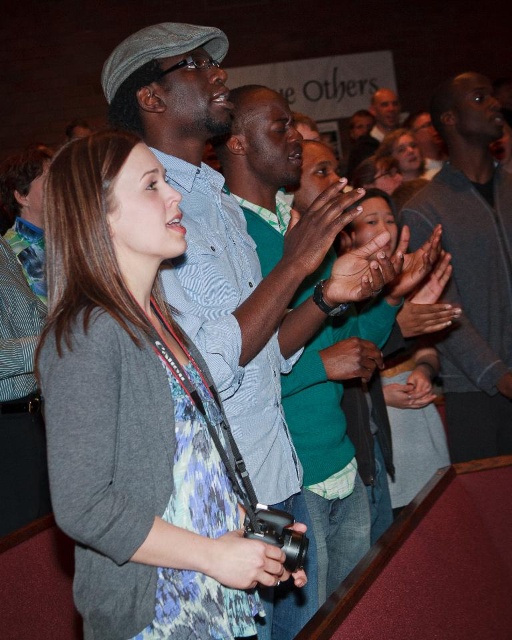
Question: Can you confirm if blue striped shirt at center is positioned below matte black hand at center?

Choices:
 (A) no
 (B) yes

Answer: (B)

Question: Which point is farther from the camera taking this photo?

Choices:
 (A) (172, 337)
 (B) (333, 362)

Answer: (B)

Question: Which point is farther to the camera?

Choices:
 (A) matte black hand at center
 (B) brown leather hand at center
 (C) matte black hands at center
 (D) silver metallic ring at center

Answer: (D)

Question: Can you confirm if blue striped shirt at center is thinner than matte black hand at center?

Choices:
 (A) yes
 (B) no

Answer: (B)

Question: Considering the relative positions of matte black hand at center and brown leather hand at center in the image provided, where is matte black hand at center located with respect to brown leather hand at center?

Choices:
 (A) right
 (B) left

Answer: (B)

Question: Which object is closer to the camera taking this photo?

Choices:
 (A) green matte shirt at center
 (B) gray sweater at upper right
 (C) matte black hands at center
 (D) matte black camera at center

Answer: (D)